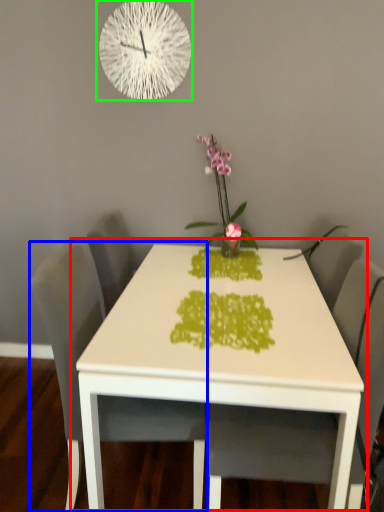
Question: Which object is positioned farthest from table (highlighted by a red box)? Select from chair (highlighted by a blue box) and wall clock (highlighted by a green box).

Choices:
 (A) chair
 (B) wall clock

Answer: (B)